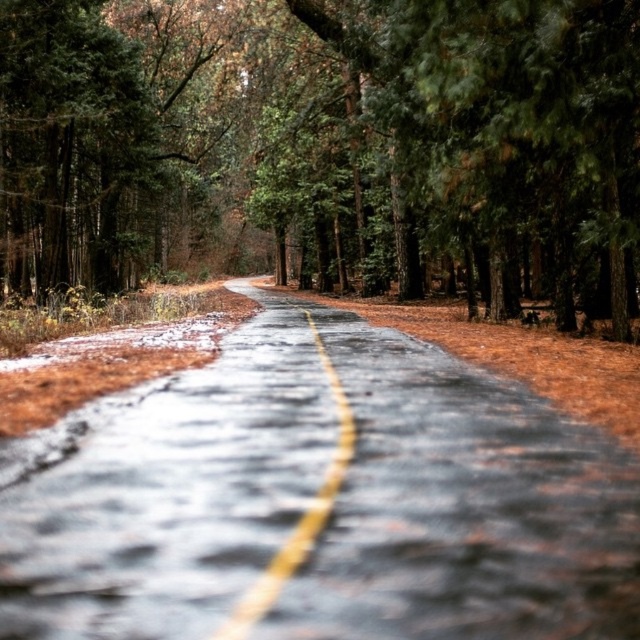
Question: Which point is closer to the camera taking this photo?

Choices:
 (A) (237, 612)
 (B) (8, 144)
 (C) (129, 516)

Answer: (A)

Question: Among these points, which one is farthest from the camera?

Choices:
 (A) (545, 172)
 (B) (464, 518)
 (C) (289, 573)

Answer: (A)

Question: Which point is farther to the camera?

Choices:
 (A) (321, 269)
 (B) (80, 602)

Answer: (A)

Question: Is green textured tree at center positioned in front of yellow matte line at center?

Choices:
 (A) no
 (B) yes

Answer: (A)

Question: Does glossy asphalt road at center have a smaller size compared to yellow matte line at center?

Choices:
 (A) yes
 (B) no

Answer: (B)

Question: Does glossy asphalt road at center come in front of yellow matte line at center?

Choices:
 (A) yes
 (B) no

Answer: (B)